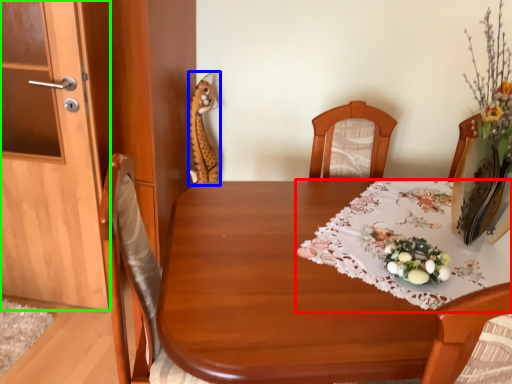
Question: Which object is the farthest from tablecloth (highlighted by a red box)? Choose among these: animal (highlighted by a blue box) or door (highlighted by a green box).

Choices:
 (A) animal
 (B) door

Answer: (A)